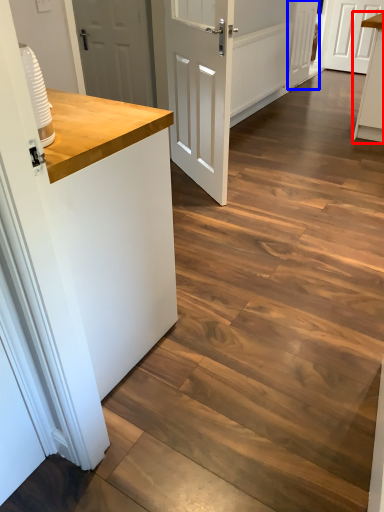
Question: Which object is closer to the camera taking this photo, cabinetry (highlighted by a red box) or door (highlighted by a blue box)?

Choices:
 (A) cabinetry
 (B) door

Answer: (A)